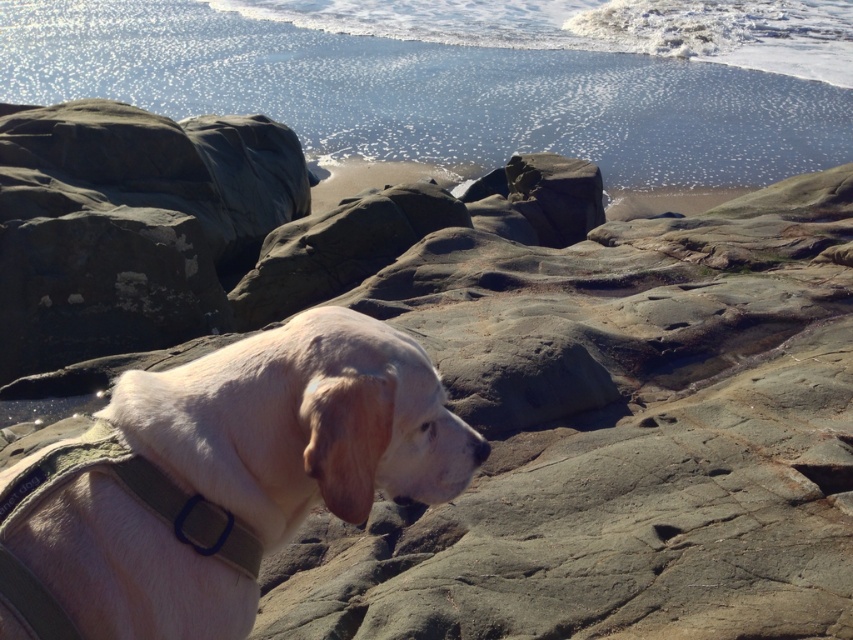
Who is taller, shiny blue water at upper center or light beige fur at center?

With more height is shiny blue water at upper center.

At what (x,y) coordinates should I click in order to perform the action: click on shiny blue water at upper center. Please return your answer as a coordinate pair (x, y). This screenshot has height=640, width=853. Looking at the image, I should click on (473, 76).

Find the location of a particular element. shiny blue water at upper center is located at coordinates (473, 76).